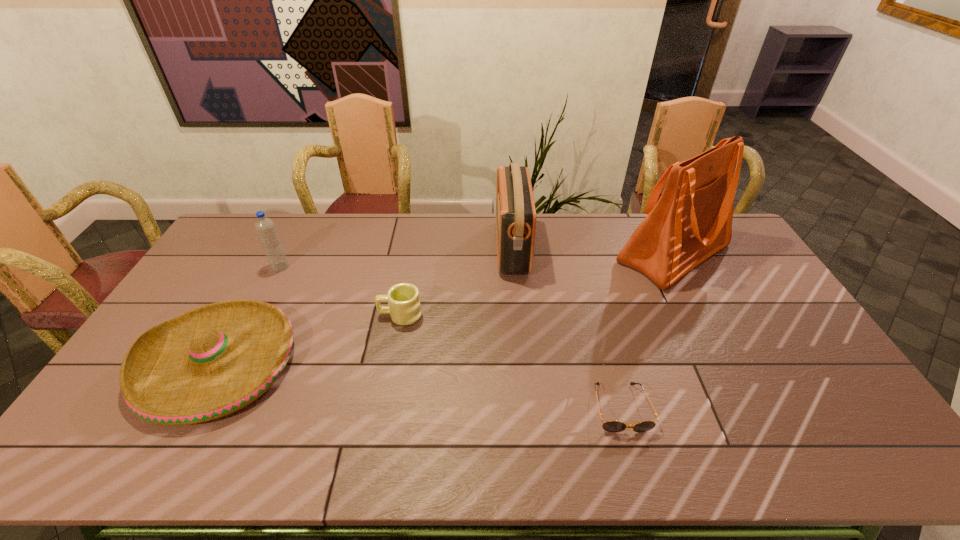
At what (x,y) coordinates should I click in order to perform the action: click on the rightmost object. Please return your answer as a coordinate pair (x, y). Looking at the image, I should click on (692, 220).

Identify the location of shopping bag. This screenshot has width=960, height=540. (692, 220).

Where is `the second tallest object`? Image resolution: width=960 pixels, height=540 pixels. the second tallest object is located at coordinates (515, 208).

This screenshot has height=540, width=960. In order to click on the third object from right to left in this screenshot , I will do `click(515, 208)`.

Image resolution: width=960 pixels, height=540 pixels. I want to click on water bottle, so click(x=265, y=227).

You are a GUI agent. You are given a task and a screenshot of the screen. Output one action in this format:
    pyautogui.click(x=<x>, y=<y>)
    Task: Click on the fourth tallest object
    
    Given the screenshot: What is the action you would take?
    211,361

Where is `the second shortest object`? This screenshot has height=540, width=960. the second shortest object is located at coordinates (403, 299).

You are a GUI agent. You are given a task and a screenshot of the screen. Output one action in this format:
    pyautogui.click(x=<x>, y=<y>)
    Task: Click on the fourth object from right to left
    
    Given the screenshot: What is the action you would take?
    pyautogui.click(x=403, y=299)

I want to click on sunglasses, so click(611, 426).

This screenshot has height=540, width=960. I want to click on the second object from right to left, so click(611, 426).